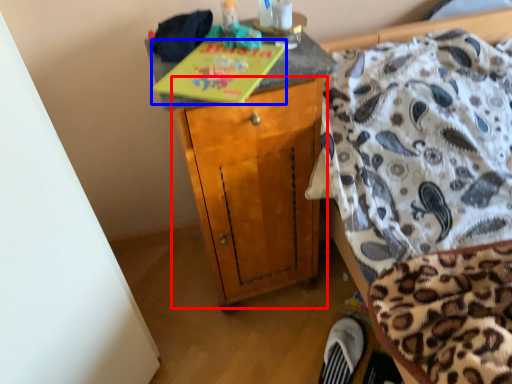
Question: Which point is closer to the camera, cabinetry (highlighted by a red box) or book (highlighted by a blue box)?

Choices:
 (A) cabinetry
 (B) book

Answer: (B)